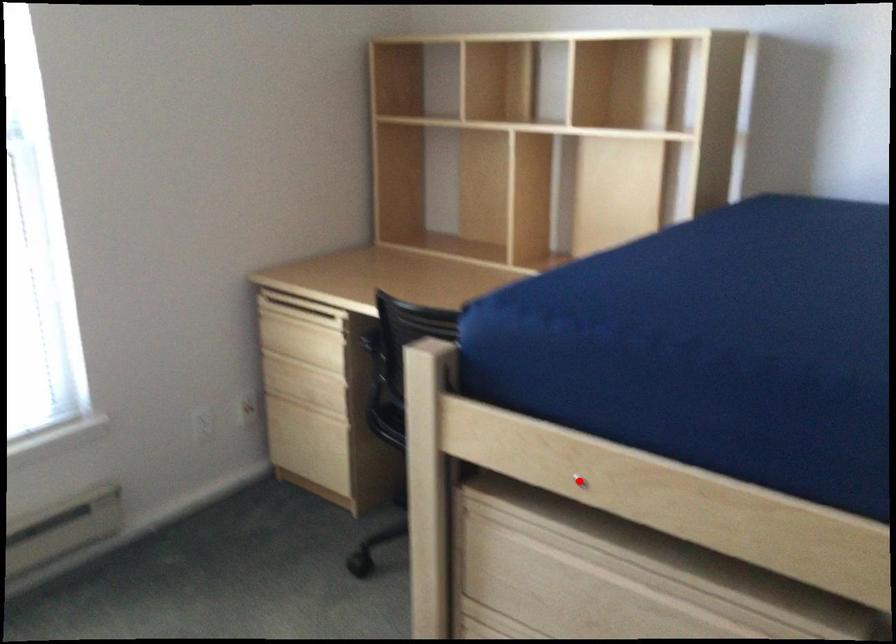
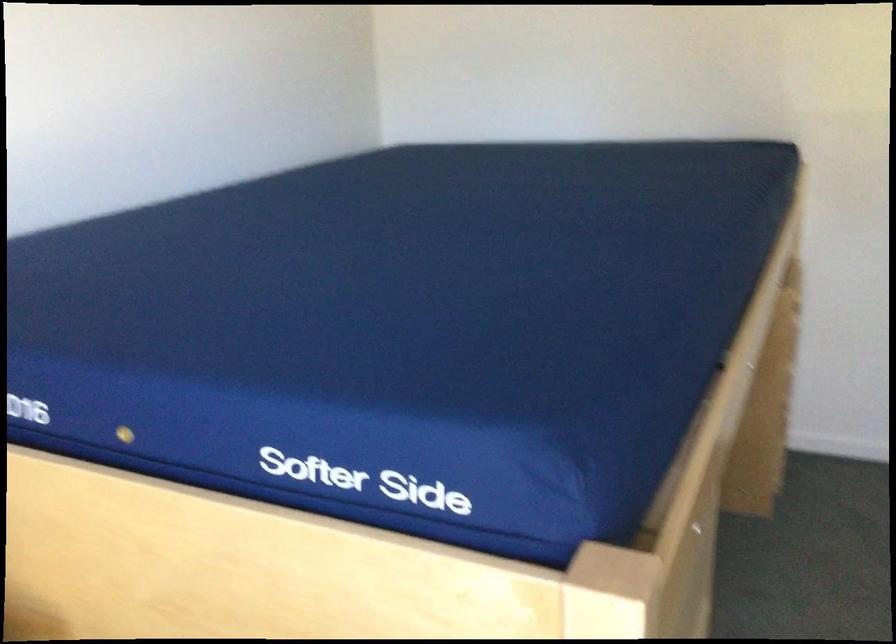
Question: I am providing you with two images of the same scene from different viewpoints. A red point is marked on the first image. Is the red point's position out of view in image 2?

Choices:
 (A) Yes
 (B) No

Answer: (A)